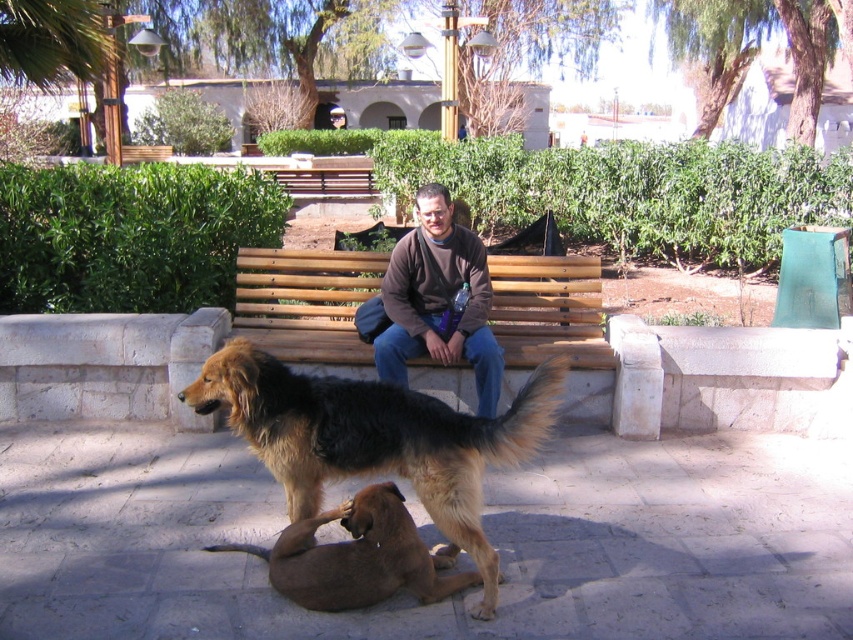
Question: Which object is closer to the camera taking this photo?

Choices:
 (A) brown fur dog at center
 (B) brown cotton shirt at center
 (C) brown fur dog at lower center
 (D) wooden bench at center

Answer: (A)

Question: Which point is closer to the camera taking this photo?

Choices:
 (A) (381, 557)
 (B) (412, 444)
 (C) (352, 374)
 (D) (438, 193)

Answer: (A)

Question: Which object is positioned closest to the brown soft sweater at center?

Choices:
 (A) brown fur dog at center
 (B) brown fur dog at lower center
 (C) brown cotton shirt at center

Answer: (A)

Question: Observing the image, what is the correct spatial positioning of brown fur dog at lower center in reference to brown cotton shirt at center?

Choices:
 (A) above
 (B) below

Answer: (B)

Question: Does wooden bench at center have a lesser width compared to brown fur dog at lower center?

Choices:
 (A) no
 (B) yes

Answer: (B)

Question: Is wooden bench at center further to camera compared to brown fur dog at lower center?

Choices:
 (A) no
 (B) yes

Answer: (B)